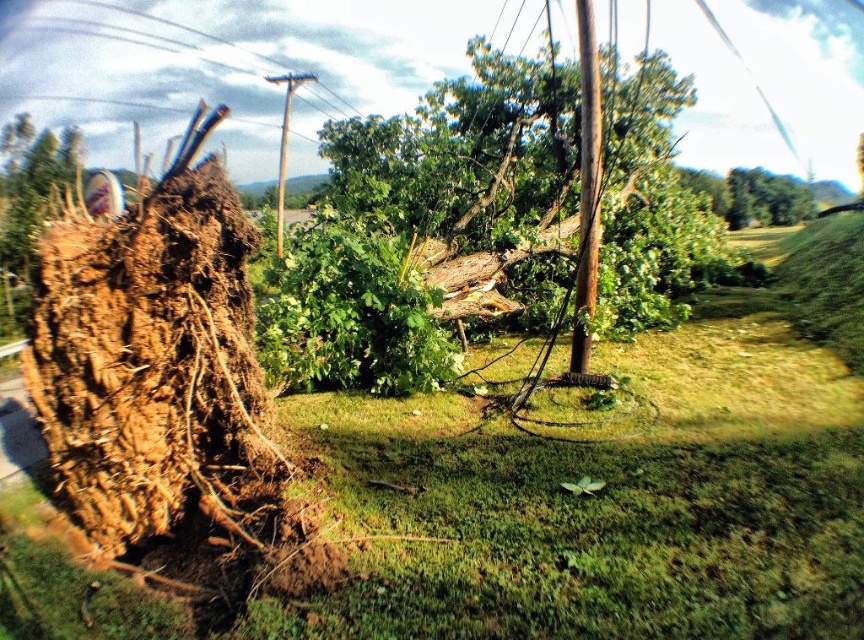
Question: Considering the real-world distances, which object is closest to the green grass at center?

Choices:
 (A) green leafy tree at center
 (B) brown wooden telegraph pole at upper center

Answer: (A)

Question: From the image, what is the correct spatial relationship of green grass at center in relation to green leafy tree at center?

Choices:
 (A) left
 (B) right

Answer: (A)

Question: Which point appears closest to the camera in this image?

Choices:
 (A) (734, 376)
 (B) (299, 72)
 (C) (588, 292)
 (D) (541, 291)

Answer: (C)

Question: Which point appears closest to the camera in this image?

Choices:
 (A) (281, 179)
 (B) (856, 221)
 (C) (573, 365)
 (D) (402, 320)

Answer: (C)

Question: Is green grass at center bigger than brown wooden pole at center?

Choices:
 (A) no
 (B) yes

Answer: (A)

Question: Does brown wooden pole at center appear on the right side of brown wooden telegraph pole at upper center?

Choices:
 (A) yes
 (B) no

Answer: (A)